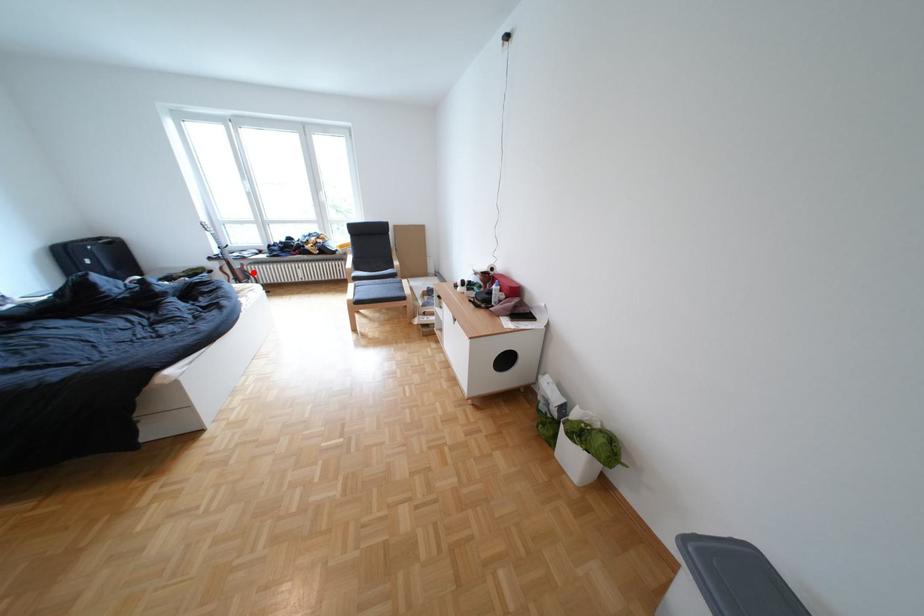
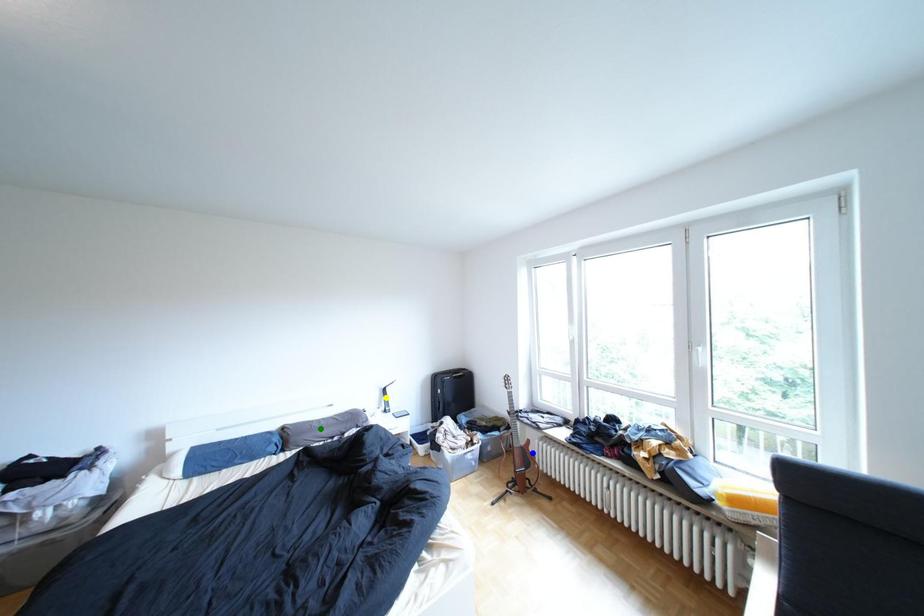
Question: I am providing you with two images of the same scene from different viewpoints. A red point is marked on the first image. You are given multiple points on the second image. In image 2, which mark is for the same physical point as the one in image 1?

Choices:
 (A) green point
 (B) blue point
 (C) yellow point

Answer: (B)